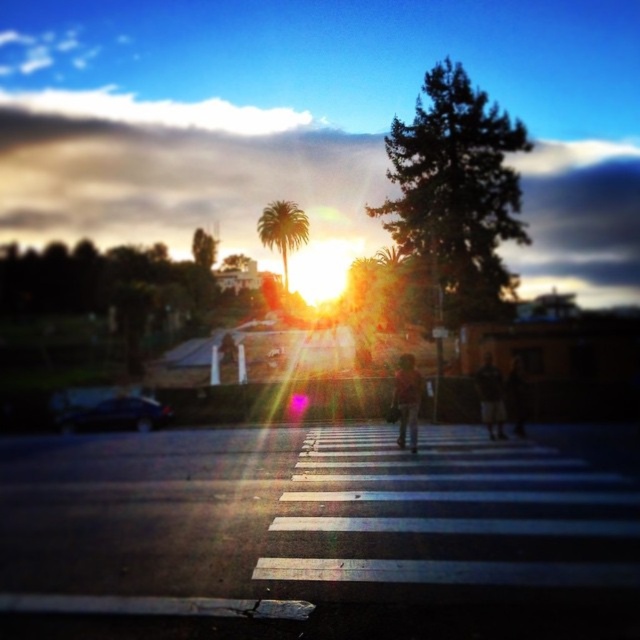
You are a delivery person who needs to carry both the orange fabric bag at center and the dark brown leather jacket at center. Which item should you pick up first if you want to carry the larger one first?

The orange fabric bag at center is larger in size than the dark brown leather jacket at center, so you should pick up the orange fabric bag at center first.